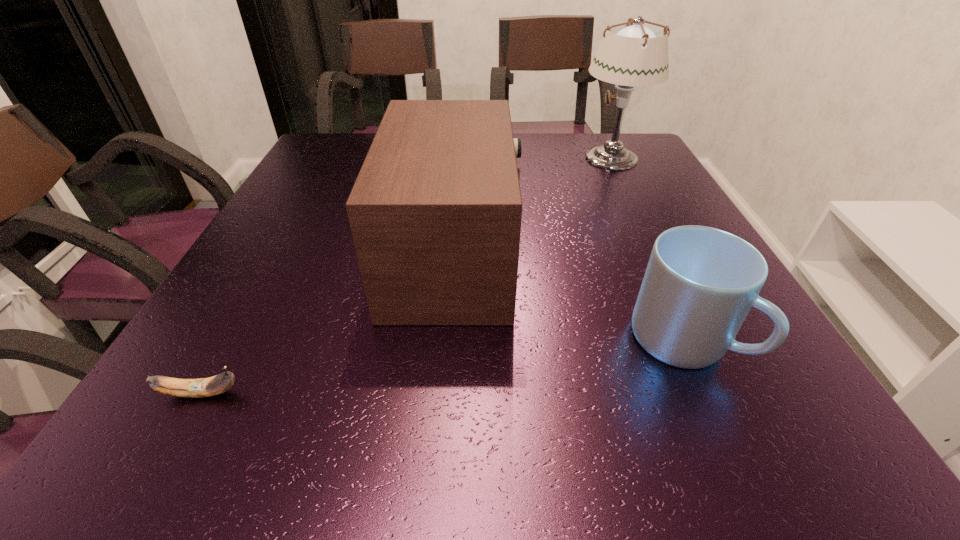
You are a GUI agent. You are given a task and a screenshot of the screen. Output one action in this format:
    pyautogui.click(x=<x>, y=<y>)
    Task: Click on the free region at the far edge of the desktop
    
    Given the screenshot: What is the action you would take?
    pyautogui.click(x=537, y=145)

The height and width of the screenshot is (540, 960). What are the coordinates of `blank space at the near edge` in the screenshot? It's located at (676, 441).

At what (x,y) coordinates should I click in order to perform the action: click on free space at the left edge. Please return your answer as a coordinate pair (x, y). This screenshot has width=960, height=540. Looking at the image, I should click on (307, 186).

This screenshot has width=960, height=540. In the image, there is a desktop. Find the location of `vacant space at the right edge`. vacant space at the right edge is located at coordinates (796, 387).

Find the location of `vacant space at the far left corner of the desktop`. vacant space at the far left corner of the desktop is located at coordinates (330, 168).

I want to click on empty location between the farthest object and the second object from left to right, so click(x=534, y=206).

Where is `free space between the second object from left to right and the shortest object`? This screenshot has height=540, width=960. free space between the second object from left to right and the shortest object is located at coordinates (328, 323).

Locate an element on the screen. This screenshot has width=960, height=540. vacant area between the mug and the banana is located at coordinates (442, 367).

This screenshot has width=960, height=540. What are the coordinates of `vacant area between the second object from left to right and the shortest object` in the screenshot? It's located at (328, 323).

Find the location of a particular element. Image resolution: width=960 pixels, height=540 pixels. unoccupied area between the leftmost object and the mug is located at coordinates (442, 367).